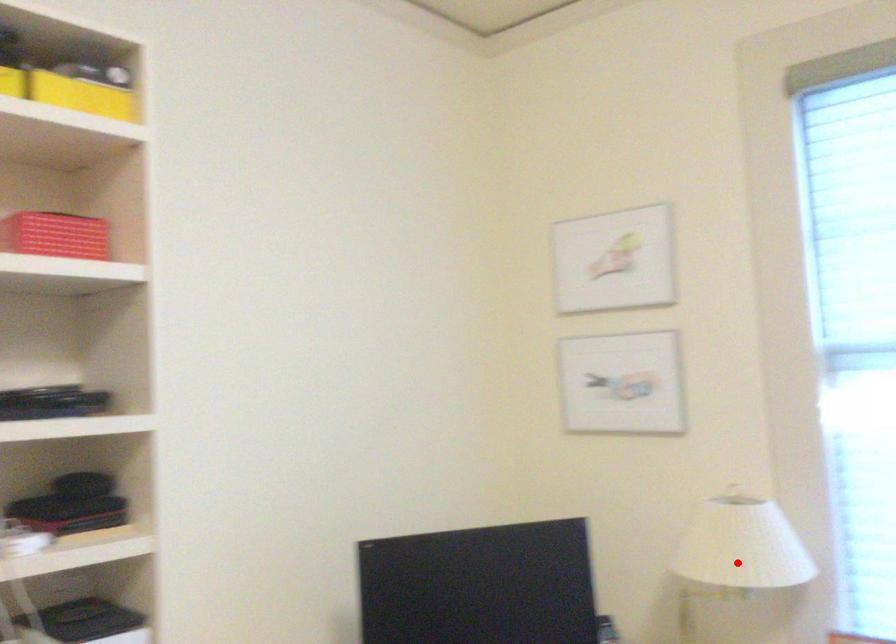
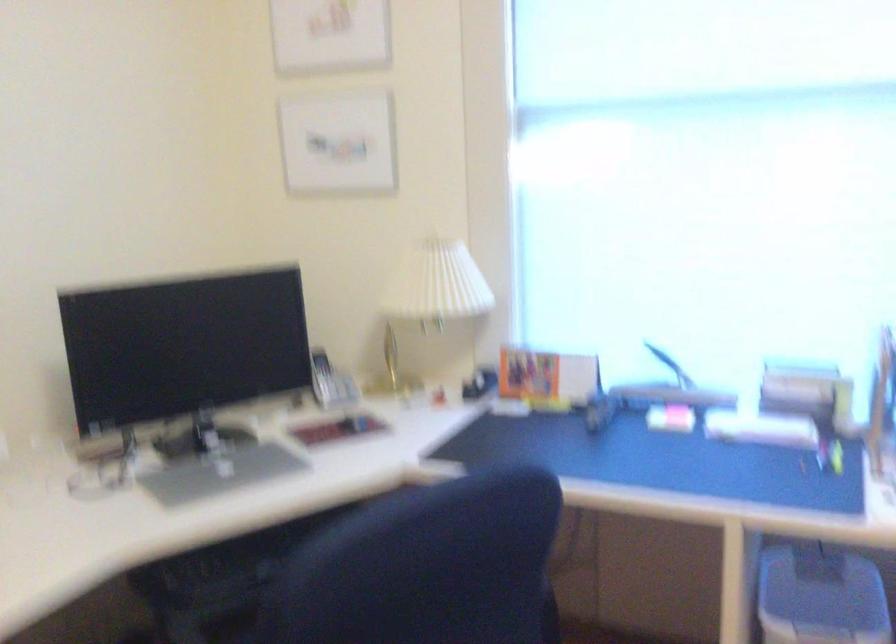
Question: I am providing you with two images of the same scene from different viewpoints. Given a red point in image1, look at the same physical point in image2. Is it:

Choices:
 (A) Closer to the viewpoint
 (B) Farther from the viewpoint

Answer: (B)